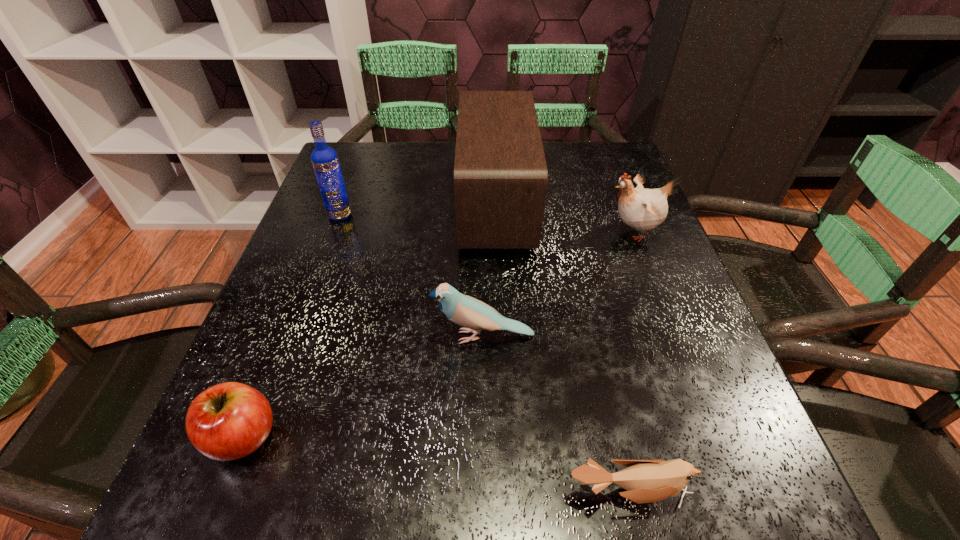
Identify the location of object at the far edge. (500, 173).

At what (x,y) coordinates should I click in order to perform the action: click on apple located in the near edge section of the desktop. Please return your answer as a coordinate pair (x, y). Looking at the image, I should click on (228, 421).

The image size is (960, 540). What are the coordinates of `bird located at the near edge` in the screenshot? It's located at (646, 481).

Find the location of a particular element. vodka positioned at the left edge is located at coordinates (325, 161).

At what (x,y) coordinates should I click in order to perform the action: click on apple that is at the left edge. Please return your answer as a coordinate pair (x, y). Image resolution: width=960 pixels, height=540 pixels. Looking at the image, I should click on (228, 421).

This screenshot has height=540, width=960. What are the coordinates of `object located in the near left corner section of the desktop` in the screenshot? It's located at (228, 421).

At what (x,y) coordinates should I click in order to perform the action: click on object that is at the near right corner. Please return your answer as a coordinate pair (x, y). This screenshot has height=540, width=960. Looking at the image, I should click on (646, 481).

At what (x,y) coordinates should I click in order to perform the action: click on free space at the far edge. Please return your answer as a coordinate pair (x, y). Looking at the image, I should click on (445, 185).

I want to click on vacant region at the near edge of the desktop, so click(x=599, y=521).

In the image, there is a desktop. Where is `vacant space at the left edge`? Image resolution: width=960 pixels, height=540 pixels. vacant space at the left edge is located at coordinates (324, 320).